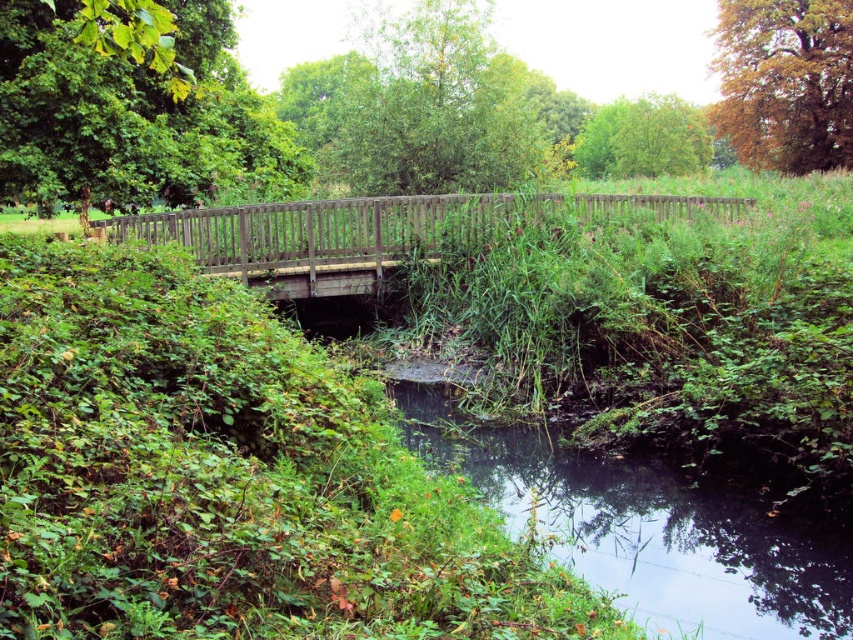
You are standing on the wooden bridge and want to locate the green grassy river at lower center. According to the coordinates provided, where should you look relative to your position on the bridge?

The green grassy river at lower center is located at coordinates point (651, 529), which means it is positioned to the lower right side of the bridge from your standing position.

You are standing on the wooden bridge and want to know the distance between the green grassy river at lower center and the green matte tree at upper left. Can you estimate it based on the scene?

The green grassy river at lower center is 15.77 meters away from the green matte tree at upper left.